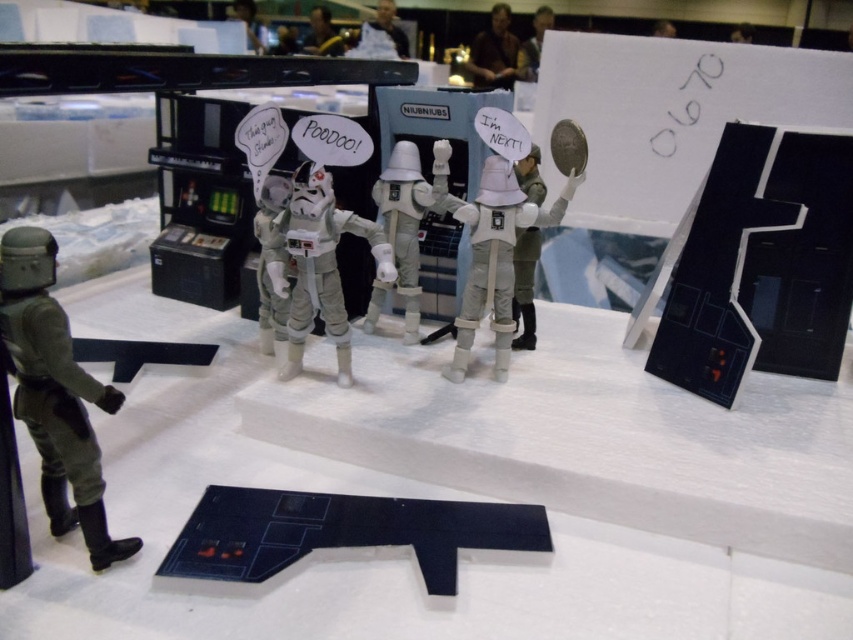
Find the location of a particular element. The width and height of the screenshot is (853, 640). matte green figure at left is located at coordinates (55, 394).

Which of these two, white matte stormtrooper at center or dark brown leather jacket at upper center, stands taller?

white matte stormtrooper at center is taller.

Can you confirm if white matte stormtrooper at center is positioned to the left of dark brown leather jacket at upper center?

Indeed, white matte stormtrooper at center is positioned on the left side of dark brown leather jacket at upper center.

Measure the distance between white matte stormtrooper at center and camera.

white matte stormtrooper at center is 1.32 meters away from camera.

Identify the location of white matte stormtrooper at center. Image resolution: width=853 pixels, height=640 pixels. (322, 264).

Which is in front, point (260, 40) or point (379, 28)?

Point (379, 28) is more forward.

Who is more distant from viewer, (242, 4) or (404, 38)?

Point (242, 4)

You are a GUI agent. You are given a task and a screenshot of the screen. Output one action in this format:
    pyautogui.click(x=<x>, y=<y>)
    Task: Click on the smooth plastic helmet at upper center
    This screenshot has height=640, width=853.
    Given the screenshot: What is the action you would take?
    pyautogui.click(x=248, y=22)